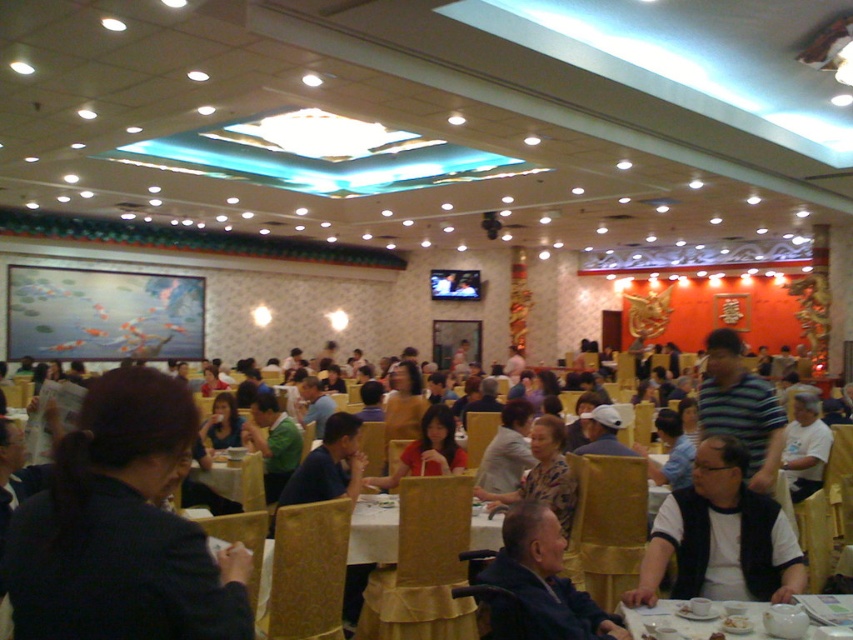
Is point (801, 589) positioned before point (788, 467)?

Yes.

Based on the photo, which of these two, dark blue shirt at center or white matte shirt at center, stands shorter?

With less height is dark blue shirt at center.

Which is in front, point (189, 403) or point (810, 460)?

Positioned in front is point (189, 403).

This screenshot has width=853, height=640. I want to click on dark blue shirt at center, so click(x=724, y=355).

Can you confirm if white matte shirt at center is positioned to the left of wooden table at center?

Incorrect, white matte shirt at center is not on the left side of wooden table at center.

Between white matte shirt at center and wooden table at center, which one is positioned higher?

white matte shirt at center is higher up.

Measure the distance between white matte shirt at center and camera.

A distance of 5.30 meters exists between white matte shirt at center and camera.

Image resolution: width=853 pixels, height=640 pixels. Find the location of `white matte shirt at center`. white matte shirt at center is located at coordinates (805, 445).

Can you confirm if dark blue fabric at lower center is positioned below white glossy table at lower center?

Actually, dark blue fabric at lower center is above white glossy table at lower center.

Who is positioned more to the left, dark blue fabric at lower center or white glossy table at lower center?

From the viewer's perspective, dark blue fabric at lower center appears more on the left side.

The width and height of the screenshot is (853, 640). Identify the location of dark blue fabric at lower center. (540, 582).

Where is `dark blue fabric at lower center`? dark blue fabric at lower center is located at coordinates (540, 582).